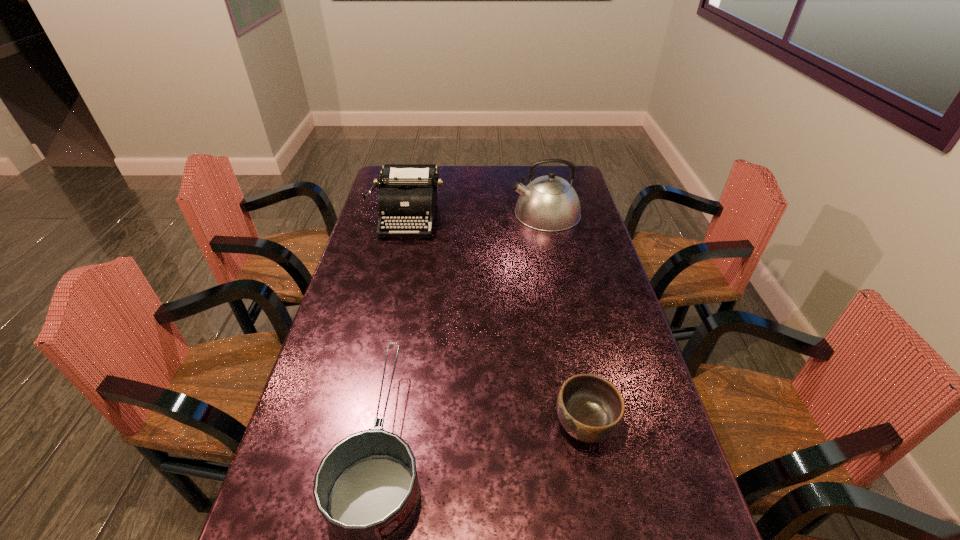
Where is `bowl located in the right edge section of the desktop`? Image resolution: width=960 pixels, height=540 pixels. bowl located in the right edge section of the desktop is located at coordinates (590, 408).

I want to click on vacant region at the far edge, so click(480, 182).

Image resolution: width=960 pixels, height=540 pixels. Identify the location of free space at the left edge of the desktop. (316, 414).

In the image, there is a desktop. Find the location of `free space at the right edge`. free space at the right edge is located at coordinates (650, 381).

This screenshot has width=960, height=540. I want to click on unoccupied position between the bowl and the kettle, so click(x=565, y=319).

Locate an element on the screen. This screenshot has width=960, height=540. free point between the bowl and the kettle is located at coordinates (565, 319).

Image resolution: width=960 pixels, height=540 pixels. Identify the location of vacant area between the tallest object and the third shortest object. (477, 215).

Find the location of `vacant area between the kettle and the bowl`. vacant area between the kettle and the bowl is located at coordinates (565, 319).

This screenshot has height=540, width=960. Identify the location of vacant space in between the tallest object and the bowl. (565, 319).

Identify the location of object that stands as the closest to the typewriter. (549, 203).